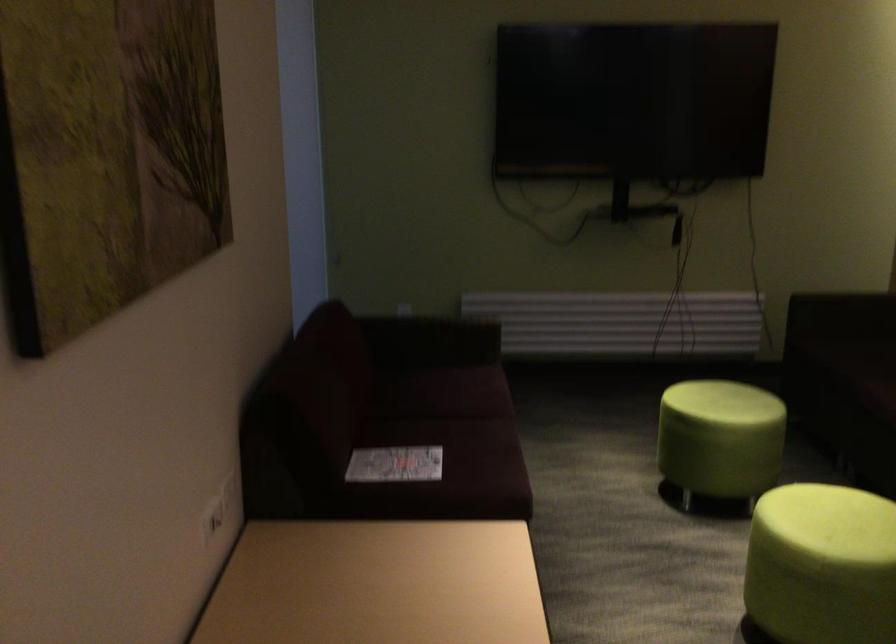
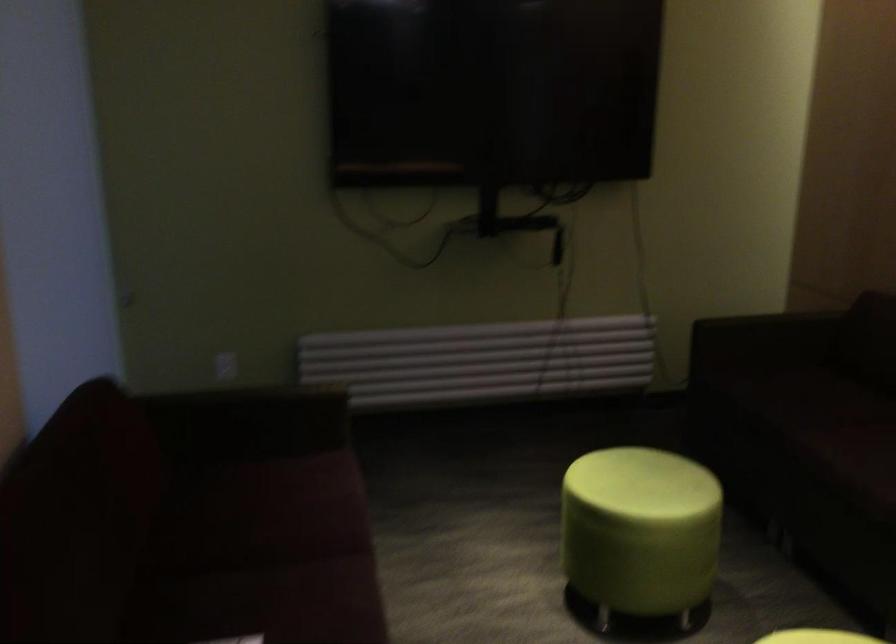
Question: Which direction would the cameraman need to move to produce the second image? Reply with the corresponding letter.

Choices:
 (A) Left
 (B) Right
 (C) Forward
 (D) Backward

Answer: (C)